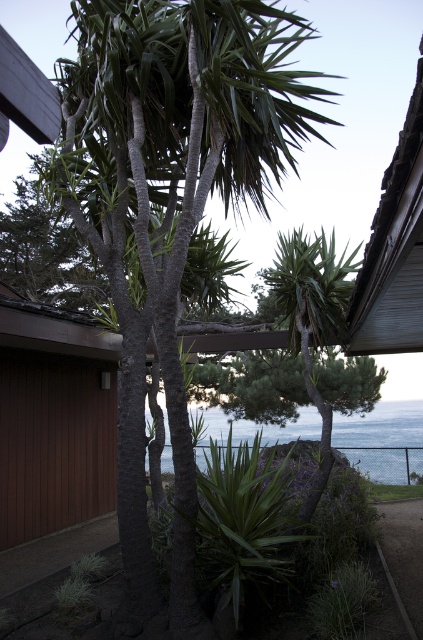
You are a photographer planning to capture the green textured palm tree at center and the blue water at center in a single shot. Based on their sizes in the scene, which object would appear more prominent in the photo?

The blue water at center would appear more prominent in the photo since the green textured palm tree at center has a smaller size compared to it.

You are standing in the coastal scene and want to take a photo of the green textured palm tree at center and the blue water at center. Which object is positioned higher in the frame?

The green textured palm tree at center is positioned higher than the blue water at center in the frame.